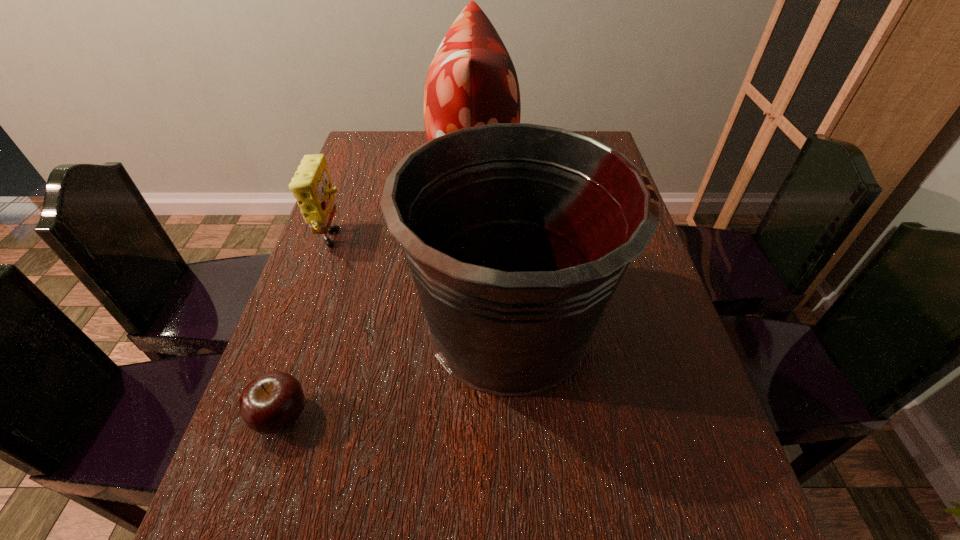
Where is `apple situated at the left edge`? This screenshot has height=540, width=960. apple situated at the left edge is located at coordinates (271, 403).

Locate an element on the screen. object at the right edge is located at coordinates point(517,235).

Where is `free spot at the left edge of the desktop`? The height and width of the screenshot is (540, 960). free spot at the left edge of the desktop is located at coordinates (348, 281).

Identify the location of blank area at the right edge. (695, 481).

Locate an element on the screen. vacant space at the far left corner is located at coordinates (380, 137).

The width and height of the screenshot is (960, 540). What are the coordinates of `vacant area between the shortest object and the cushion` in the screenshot? It's located at tap(377, 293).

This screenshot has width=960, height=540. In order to click on blank region between the apple and the farthest object in this screenshot , I will do `click(377, 293)`.

Identify which object is located as the second nearest to the farthest object. Please provide its 2D coordinates. Your answer should be formatted as a tuple, i.e. [(x, y)], where the tuple contains the x and y coordinates of a point satisfying the conditions above.

[(311, 185)]

Locate an element on the screen. This screenshot has width=960, height=540. object that ranks as the second closest to the apple is located at coordinates (311, 185).

The image size is (960, 540). I want to click on free space that satisfies the following two spatial constraints: 1. on the front-facing side of the cushion; 2. on the front side of the apple, so click(x=468, y=417).